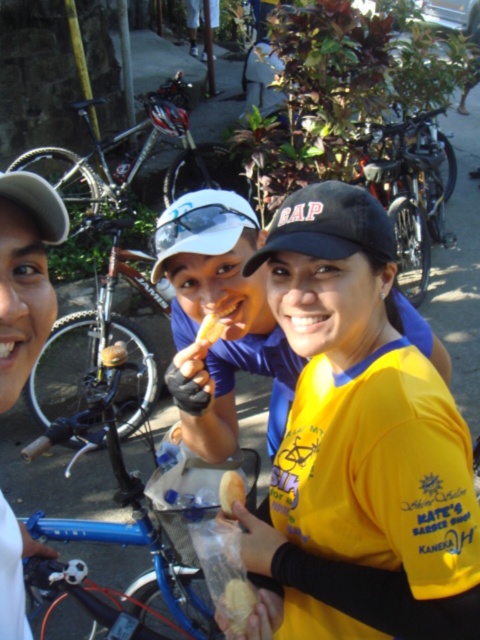
You are a photographer at the event and want to capture a photo that includes both the silver metallic bicycle at upper left and the golden brown crumbly pastry at center. Based on their positions, which object should be placed on the left side of the photo to ensure both are in frame?

The silver metallic bicycle at upper left should be placed on the left side of the photo since it is already positioned to the left of the golden brown crumbly pastry at center.

You are taking a photo of an outdoor event with two points marked in the image. The first point is at coordinates point (84, 122) and the second is at point (225, 509). Which point is closer to the camera?

Point (84, 122) is closer to the camera than point (225, 509) because it is further to the camera than the other point.